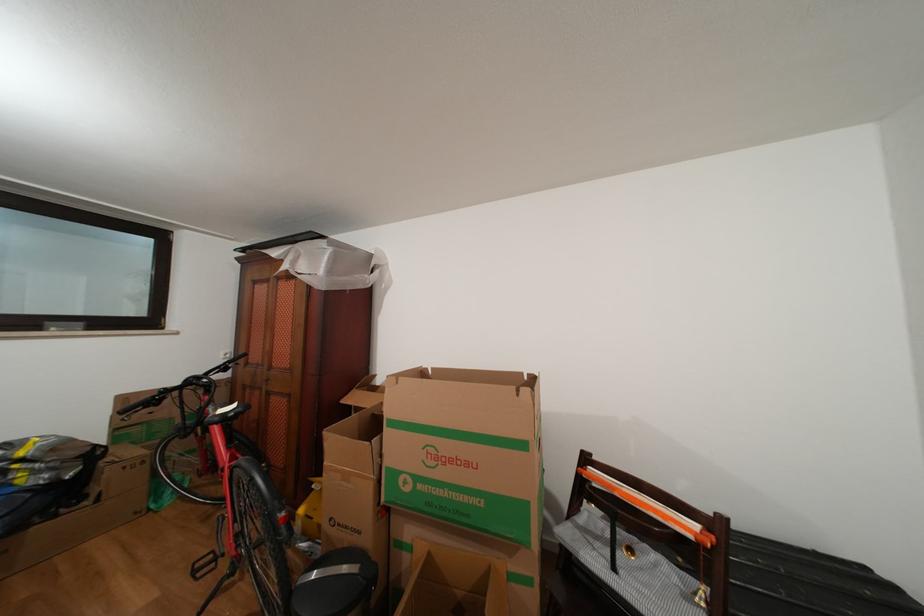
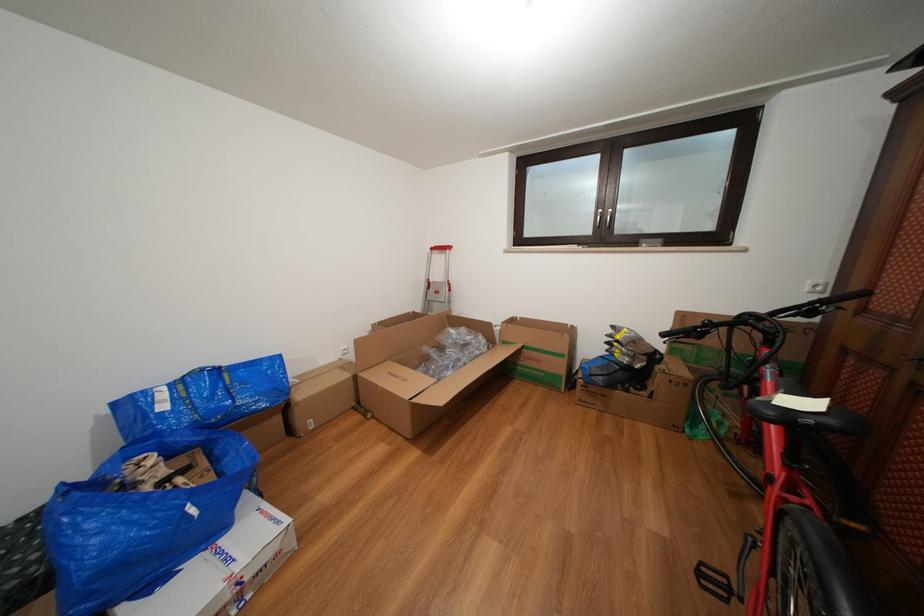
The point at (209, 378) is marked in the first image. Where is the corresponding point in the second image?

(772, 315)